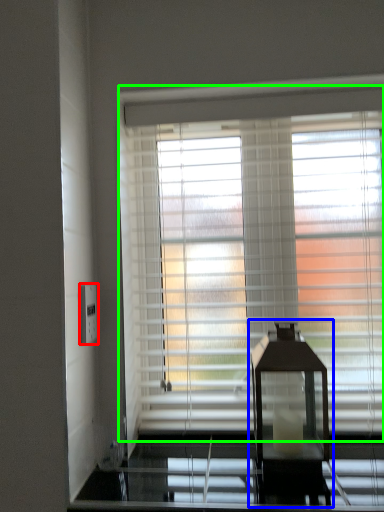
Question: Which object is the closest to the electric outlet (highlighted by a red box)? Choose among these: table lamp (highlighted by a blue box) or window blind (highlighted by a green box).

Choices:
 (A) table lamp
 (B) window blind

Answer: (B)